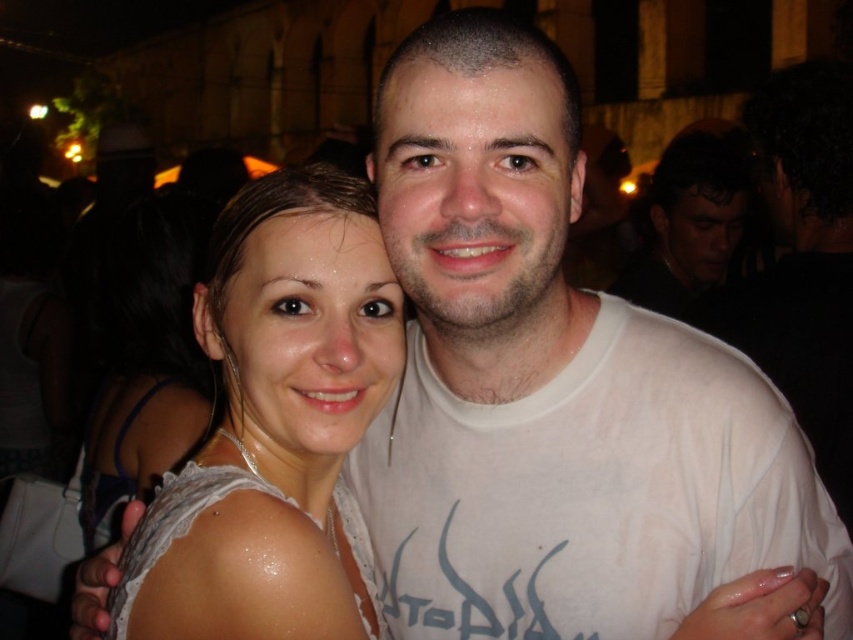
You are standing at the point marked as point (265, 540) in the image. The man and woman are 37.71 meters away from you. Can you see their faces clearly?

The man and woman are 37.71 meters away from you, so you cannot see their faces clearly from that distance.